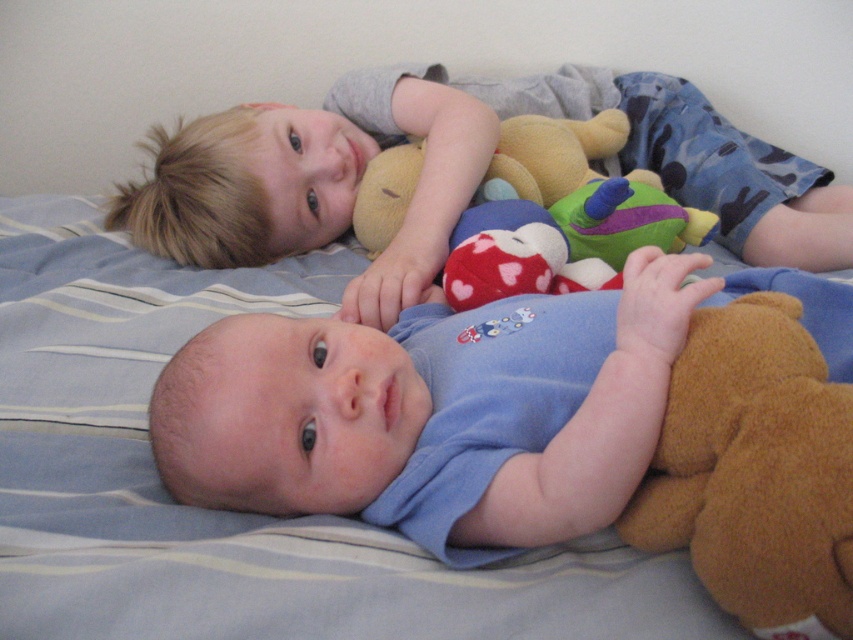
Question: Is blue soft baby at center positioned at the back of brown plush bear at lower right?

Choices:
 (A) no
 (B) yes

Answer: (B)

Question: Is the position of blue soft bed at center more distant than that of blonde hair at upper left?

Choices:
 (A) yes
 (B) no

Answer: (B)

Question: Which of the following is the closest to the observer?

Choices:
 (A) 717,204
 (B) 483,397
 (C) 683,524

Answer: (C)

Question: Which object is farther from the camera taking this photo?

Choices:
 (A) brown plush bear at lower right
 (B) blue soft bed at center
 (C) blue soft baby at center
 (D) blonde hair at upper left

Answer: (D)

Question: Does blue soft baby at center come in front of brown plush bear at lower right?

Choices:
 (A) no
 (B) yes

Answer: (A)

Question: Which of these objects is positioned farthest from the blue soft baby at center?

Choices:
 (A) blue soft bed at center
 (B) blonde hair at upper left

Answer: (B)